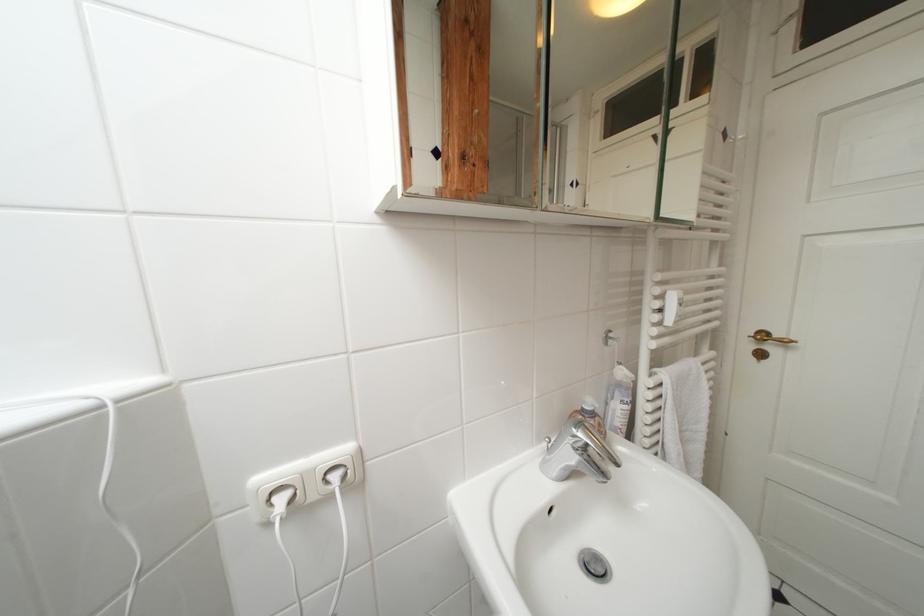
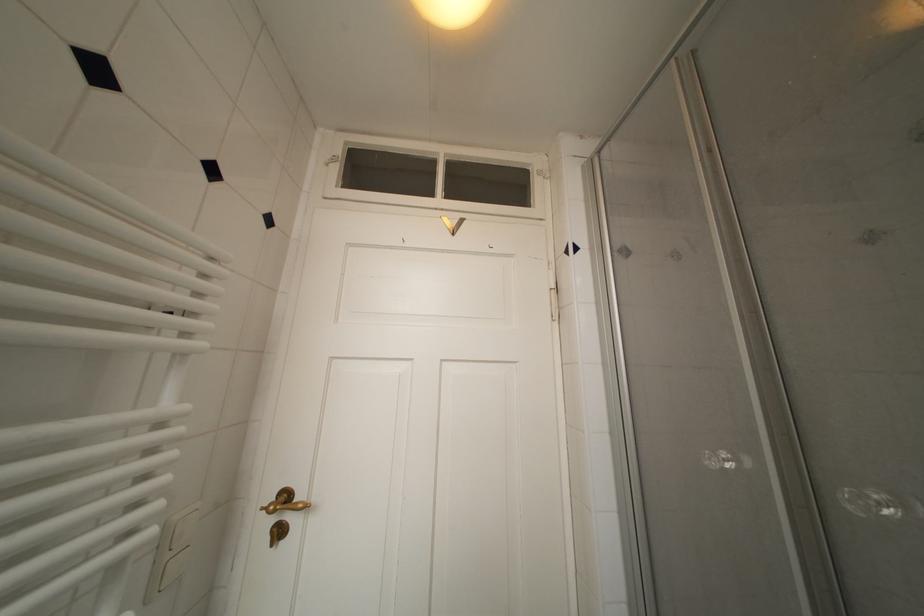
Find the pixel in the second image that matches (769,339) in the first image.

(293, 500)